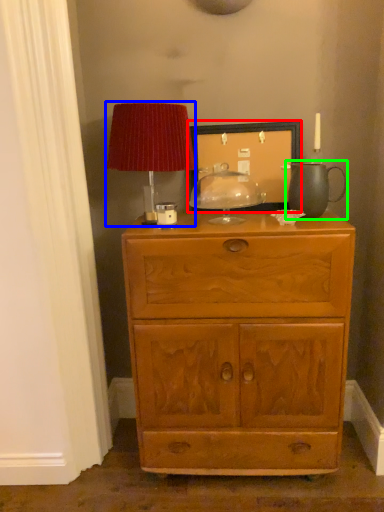
Question: Which object is positioned farthest from picture frame (highlighted by a red box)? Select from table lamp (highlighted by a blue box) and tea pot (highlighted by a green box).

Choices:
 (A) table lamp
 (B) tea pot

Answer: (A)